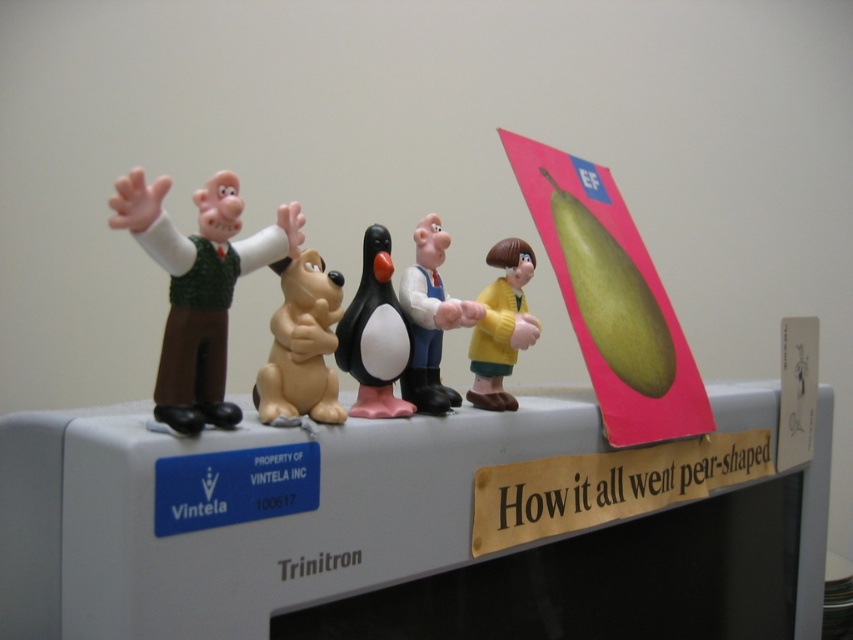
Between tan rubber dog at center and yellow matte figurine at center, which one has less height?

With less height is tan rubber dog at center.

Does tan rubber dog at center appear on the left side of yellow matte figurine at center?

Yes, tan rubber dog at center is to the left of yellow matte figurine at center.

The height and width of the screenshot is (640, 853). What do you see at coordinates (302, 344) in the screenshot?
I see `tan rubber dog at center` at bounding box center [302, 344].

Locate an element on the screen. The image size is (853, 640). tan rubber dog at center is located at coordinates (302, 344).

Does matte green vest at center have a smaller size compared to black matte penguin at center?

Actually, matte green vest at center might be larger than black matte penguin at center.

Does point (196, 384) come in front of point (381, 227)?

Yes, it is.

This screenshot has height=640, width=853. What are the coordinates of `matte green vest at center` in the screenshot? It's located at pyautogui.click(x=199, y=288).

Is black matte penguin at center thinner than white plastic figure at center?

Yes, black matte penguin at center is thinner than white plastic figure at center.

In the scene shown: Which is above, black matte penguin at center or white plastic figure at center?

white plastic figure at center is higher up.

Find the location of `black matte penguin at center`. black matte penguin at center is located at coordinates (375, 333).

Where is `black matte penguin at center`? This screenshot has height=640, width=853. black matte penguin at center is located at coordinates (375, 333).